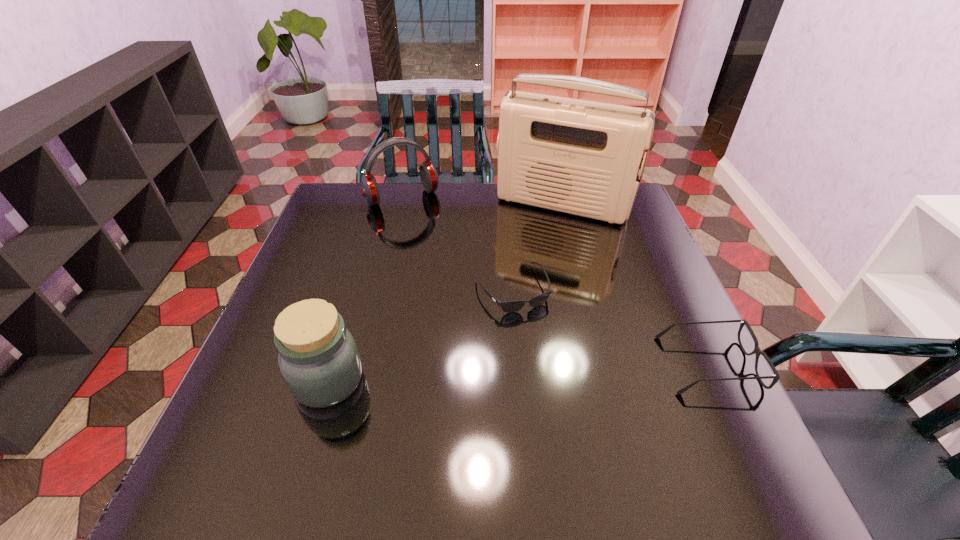
Image resolution: width=960 pixels, height=540 pixels. I want to click on vacant space situated 0.230m on the front-facing side of the radio receiver, so click(518, 274).

Locate an element on the screen. vacant region located 0.200m on the front-facing side of the radio receiver is located at coordinates (521, 267).

In order to click on free space located 0.130m on the front-facing side of the radio receiver in this screenshot , I will do `click(529, 252)`.

Find the location of a particular element. The height and width of the screenshot is (540, 960). free space located 0.390m on the ear cups of the earphone is located at coordinates (465, 290).

Locate an element on the screen. vacant space located 0.110m on the ear cups of the earphone is located at coordinates (427, 231).

Find the location of a particular element. The image size is (960, 540). vacant space located on the ear cups of the earphone is located at coordinates (448, 265).

You are a GUI agent. You are given a task and a screenshot of the screen. Output one action in this format:
    pyautogui.click(x=<x>, y=<y>)
    Task: Click on the vacant point located on the front-facing side of the shortest object
    
    Given the screenshot: What is the action you would take?
    pyautogui.click(x=541, y=342)

The height and width of the screenshot is (540, 960). I want to click on vacant position located 0.110m on the front-facing side of the shortest object, so click(545, 349).

Find the location of `vacant space located 0.330m on the front-facing side of the shortest object`. vacant space located 0.330m on the front-facing side of the shortest object is located at coordinates (594, 438).

Find the location of a particular element. The image size is (960, 540). radio receiver that is at the far edge is located at coordinates (581, 157).